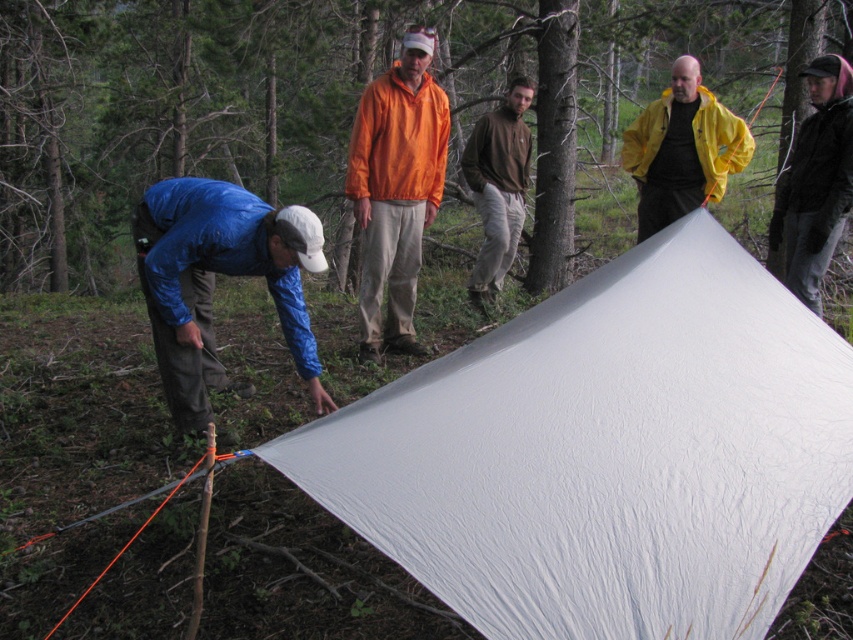
Question: Which point appears farthest from the camera in this image?

Choices:
 (A) (498, 64)
 (B) (822, 186)
 (C) (759, 515)

Answer: (A)

Question: Does white fabric tarp at center appear on the right side of blue waterproof jacket at lower left?

Choices:
 (A) yes
 (B) no

Answer: (B)

Question: Is yellow matte jacket at upper right positioned at the back of brown cotton shirt at center?

Choices:
 (A) no
 (B) yes

Answer: (A)

Question: Which point is closer to the camera?

Choices:
 (A) (155, 273)
 (B) (495, 276)
 (C) (209, 172)

Answer: (A)

Question: Considering the real-world distances, which object is closest to the yellow matte jacket at upper right?

Choices:
 (A) white fabric tarp at center
 (B) black matte jacket at upper right
 (C) brown cotton shirt at center
 (D) white matte tarp at center

Answer: (B)

Question: Is white matte tarp at center bigger than blue waterproof jacket at lower left?

Choices:
 (A) yes
 (B) no

Answer: (A)